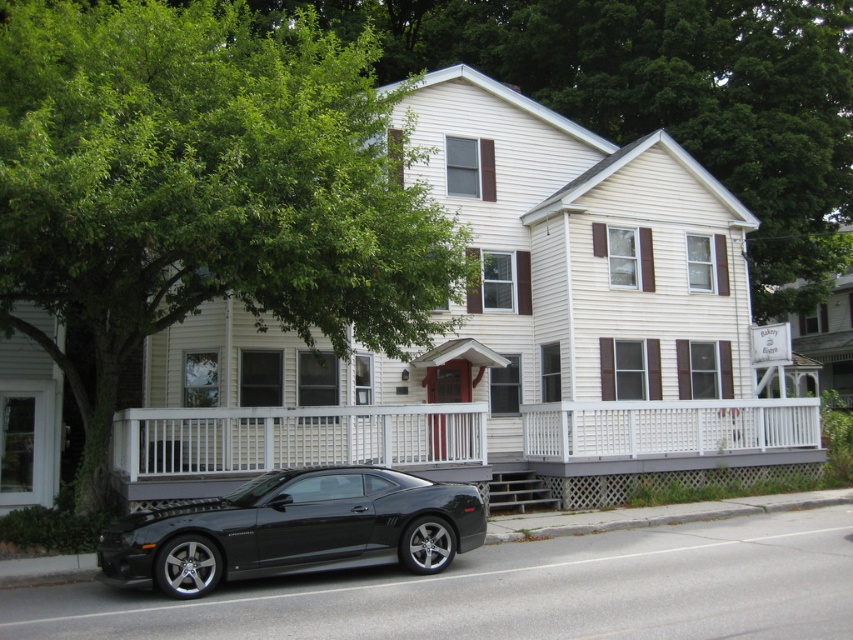
Can you confirm if green leafy tree at upper left is thinner than white wooden porch at lower center?

Yes.

Can you confirm if green leafy tree at upper left is positioned below white wooden porch at lower center?

No.

I want to click on green leafy tree at upper left, so click(x=204, y=189).

Locate an element on the screen. The height and width of the screenshot is (640, 853). green leafy tree at upper left is located at coordinates (204, 189).

Is point (64, 136) farther from viewer compared to point (167, 595)?

Yes, it is behind point (167, 595).

Does green leafy tree at upper left have a lesser width compared to black glossy sedan at lower left?

No.

Identify the location of green leafy tree at upper left. The width and height of the screenshot is (853, 640). (x=204, y=189).

This screenshot has width=853, height=640. I want to click on green leafy tree at upper left, so click(204, 189).

Does point (711, 456) lie behind point (431, 529)?

That is True.

This screenshot has height=640, width=853. What do you see at coordinates (469, 444) in the screenshot? I see `white wooden porch at lower center` at bounding box center [469, 444].

I want to click on white wooden porch at lower center, so click(469, 444).